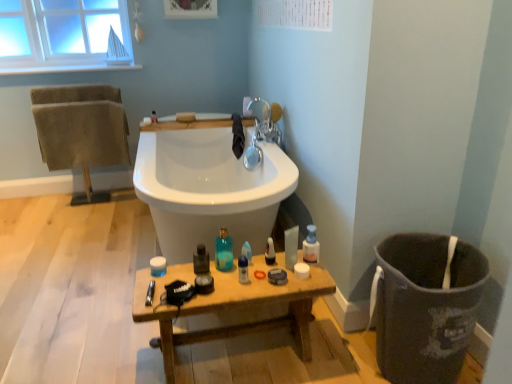
Find the location of a particular element. The height and width of the screenshot is (384, 512). vacant space to the right of translucent blue glass bottle at center, the 2th toiletry when ordered from right to left is located at coordinates (263, 268).